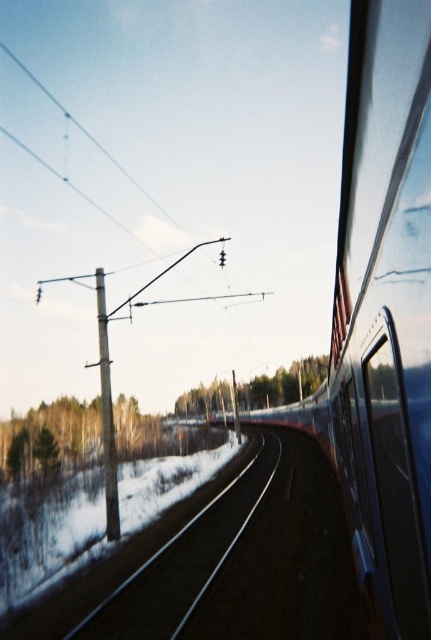
You are standing inside the train and looking through the window. You see a point marked at coordinates (x=184, y=561). What object is located at that point?

The metal smooth track at center is located at point (x=184, y=561).